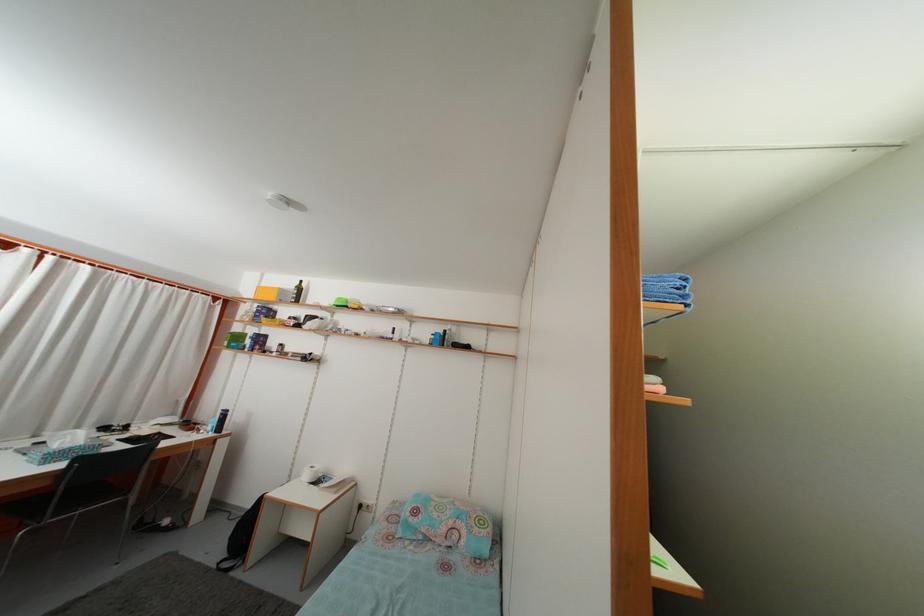
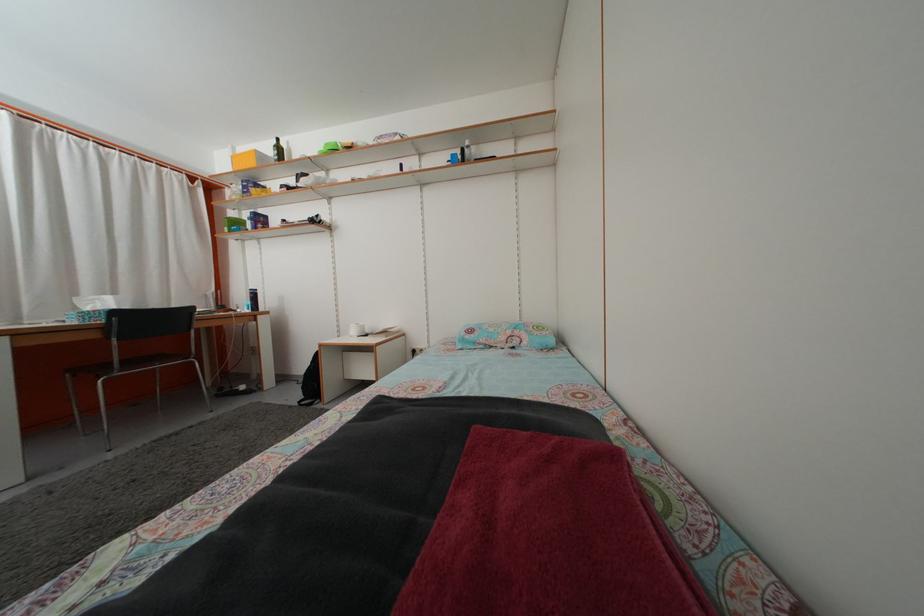
Where in the second image is the point corresponding to point (232, 562) from the first image?

(309, 405)